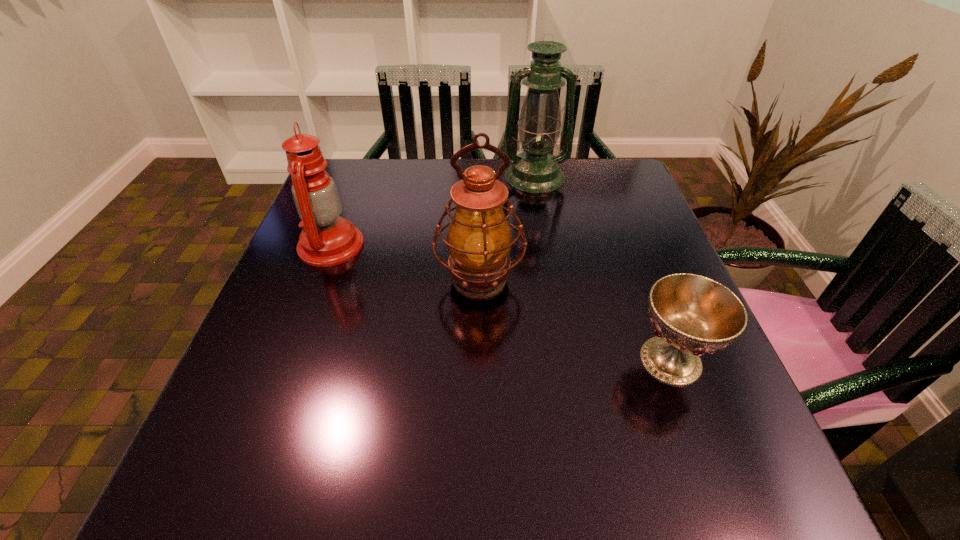
At what (x,y) coordinates should I click in order to perform the action: click on the farthest oil lamp. Please return your answer as a coordinate pair (x, y). This screenshot has width=960, height=540. Looking at the image, I should click on (x=535, y=170).

Where is `the leftmost object`? The image size is (960, 540). the leftmost object is located at coordinates (327, 239).

Identify the location of the nearest object. point(692,315).

Locate an element on the screen. This screenshot has width=960, height=540. the shortest object is located at coordinates (692, 315).

Locate an element on the screen. free space located on the right of the farthest oil lamp is located at coordinates (600, 177).

This screenshot has width=960, height=540. I want to click on vacant space located 0.180m on the right of the leftmost object, so click(442, 245).

Locate an element on the screen. The height and width of the screenshot is (540, 960). free space located 0.100m on the front of the shortest object is located at coordinates (707, 455).

Identify the location of object that is positioned at the far edge. The height and width of the screenshot is (540, 960). (535, 170).

Locate an element on the screen. Image resolution: width=960 pixels, height=540 pixels. object located in the left edge section of the desktop is located at coordinates (327, 239).

The width and height of the screenshot is (960, 540). What are the coordinates of `object present at the right edge` in the screenshot? It's located at (x=692, y=315).